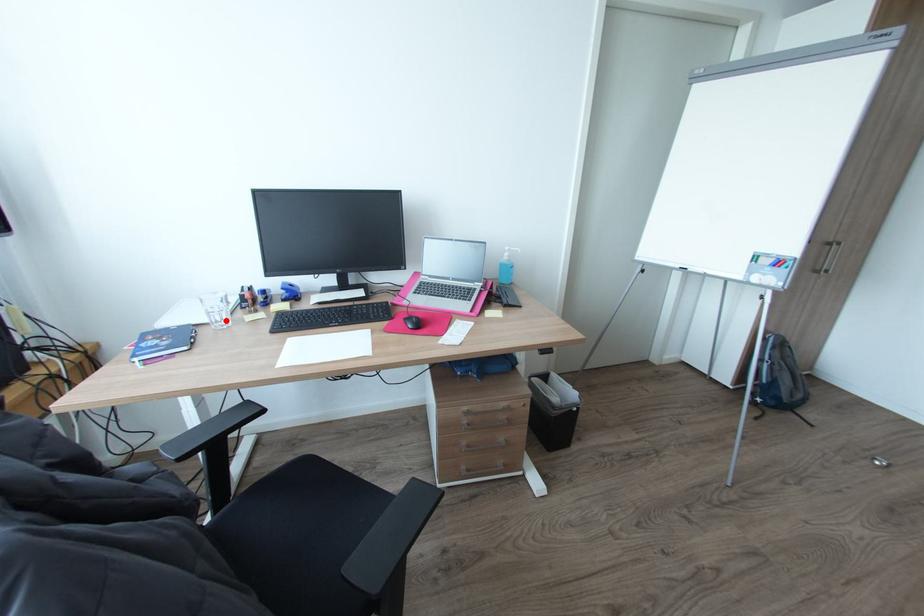
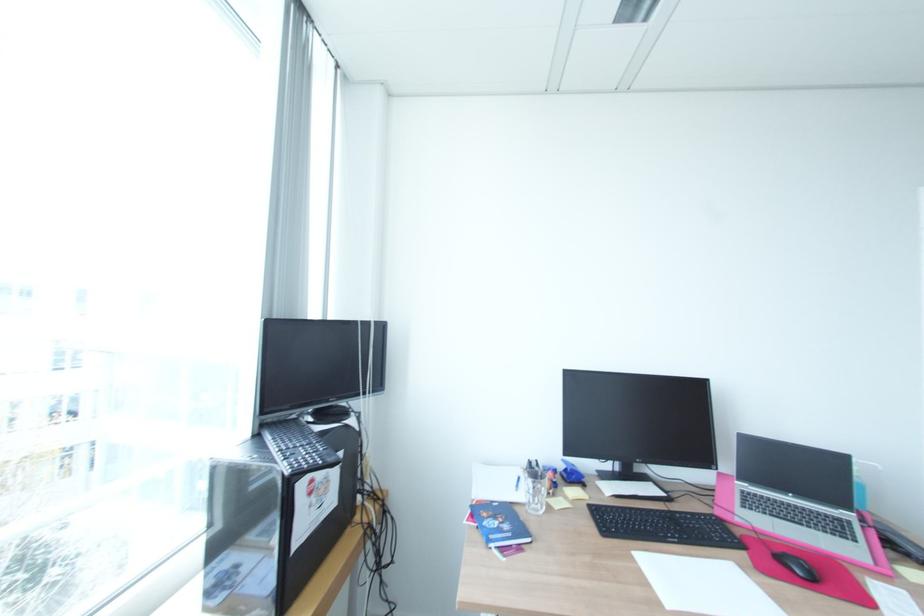
Find the pixel in the second image that matches the highlighted location in the first image.

(541, 505)